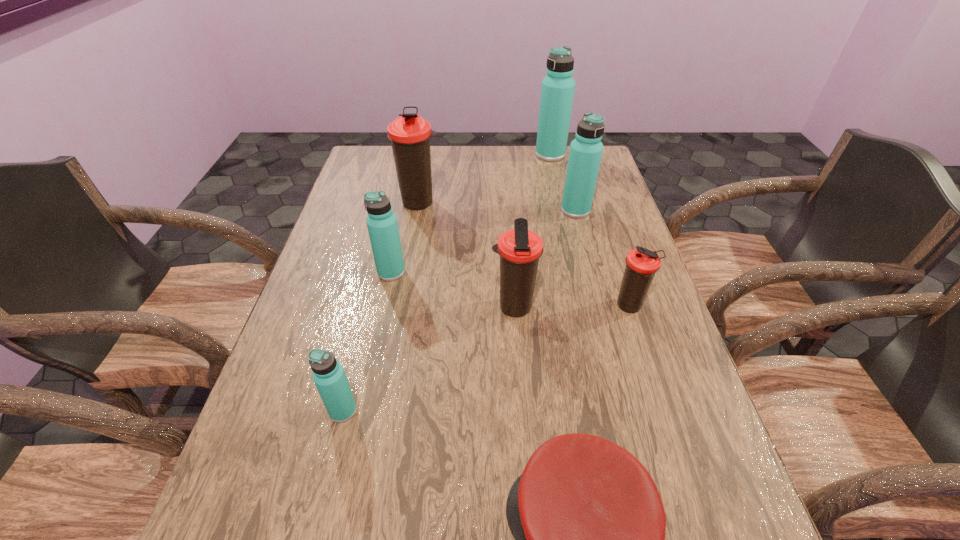
Locate an element on the screen. the nearest thermos bottle is located at coordinates (328, 375).

Find the location of `the rightmost brown thermos bottle`. the rightmost brown thermos bottle is located at coordinates (641, 264).

The width and height of the screenshot is (960, 540). In order to click on free location located on the front of the tallest thermos bottle in this screenshot , I will do `click(561, 201)`.

Identify the location of vacant space located on the right of the farthest brown thermos bottle. This screenshot has width=960, height=540. (493, 202).

The width and height of the screenshot is (960, 540). What are the coordinates of `free region located on the back of the third nearest aqua thermos bottle` in the screenshot? It's located at pyautogui.click(x=560, y=150).

Where is `vacant point located 0.340m on the left of the fourth thermos bottle from right to left`? The image size is (960, 540). vacant point located 0.340m on the left of the fourth thermos bottle from right to left is located at coordinates (348, 307).

Locate an element on the screen. free space located on the front of the second smallest aqua thermos bottle is located at coordinates (375, 348).

You are a GUI agent. You are given a task and a screenshot of the screen. Output one action in this format:
    pyautogui.click(x=<x>, y=<y>)
    Task: Click on the free space located on the right of the nearest thermos bottle
    
    Given the screenshot: What is the action you would take?
    point(464,410)

At what (x,y) coordinates should I click in order to perform the action: click on vacant region located on the front of the rightmost brown thermos bottle. Please return your answer as a coordinate pair (x, y). Image resolution: width=960 pixels, height=540 pixels. Looking at the image, I should click on (694, 501).

The image size is (960, 540). What are the coordinates of `object at the far edge` in the screenshot? It's located at (557, 92).